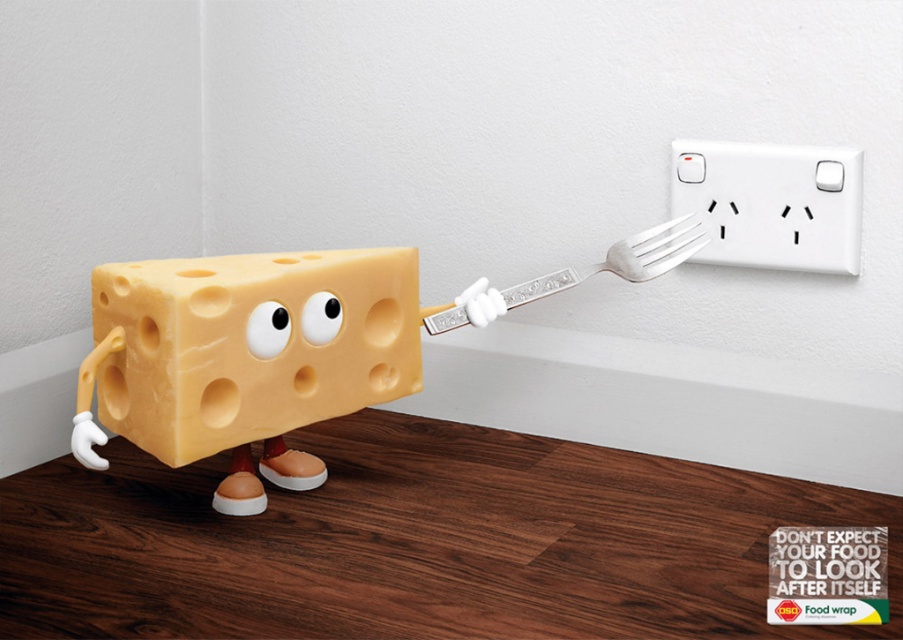
You are a chef preparing a dish and need to choose between the yellow cheese block at center and the silver metallic fork at upper right. Which object is wider?

The yellow cheese block at center is wider than the silver metallic fork at upper right.

You are a robotic arm trying to plug the silver metallic fork at upper right into the white plastic socket at upper right. Which direction should you move the fork to align it with the socket?

The white plastic socket at upper right is to the right of the silver metallic fork at upper right, so you should move the silver metallic fork at upper right to the right to align it with the white plastic socket at upper right.